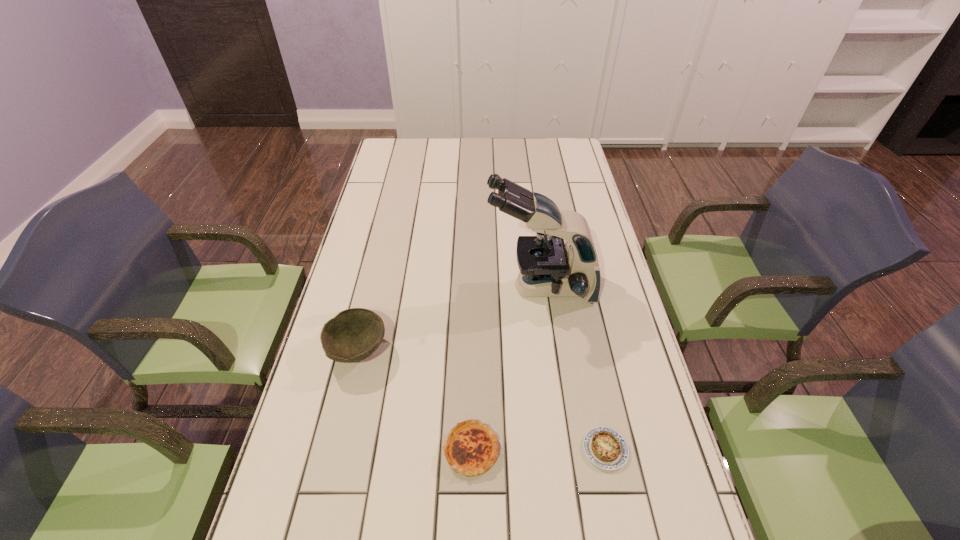
Locate an element on the screen. the farthest object is located at coordinates (548, 268).

This screenshot has width=960, height=540. What are the coordinates of `microscope` in the screenshot? It's located at (548, 268).

At what (x,y) coordinates should I click in order to perform the action: click on the third shortest object. Please return your answer as a coordinate pair (x, y). This screenshot has height=540, width=960. Looking at the image, I should click on (353, 334).

Identify the location of the third nearest object. (353, 334).

This screenshot has width=960, height=540. I want to click on the taller quiche, so click(471, 449).

The width and height of the screenshot is (960, 540). I want to click on the left quiche, so click(x=471, y=449).

Where is `the right quiche`? The width and height of the screenshot is (960, 540). the right quiche is located at coordinates (606, 448).

This screenshot has width=960, height=540. In order to click on the shortest object in this screenshot , I will do `click(606, 448)`.

Locate an element on the screen. free region located through the eyepieces of the tallest object is located at coordinates (447, 287).

This screenshot has width=960, height=540. What are the coordinates of `vacant position located 0.270m through the eyepieces of the tallest object` in the screenshot? It's located at (399, 287).